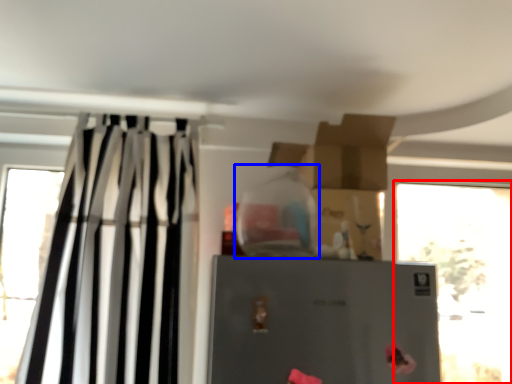
Question: Which point is further to the camera, window (highlighted by a red box) or bottle (highlighted by a blue box)?

Choices:
 (A) window
 (B) bottle

Answer: (A)